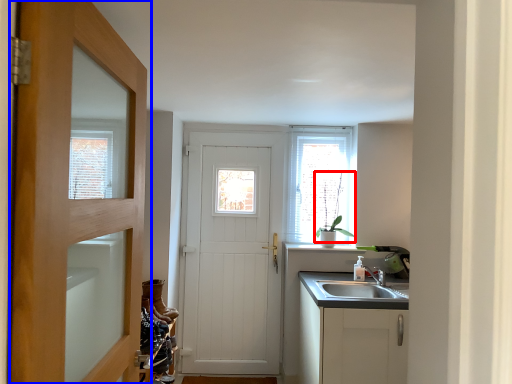
Question: Which of the following is the farthest to the observer, plant (highlighted by a red box) or door (highlighted by a blue box)?

Choices:
 (A) plant
 (B) door

Answer: (A)